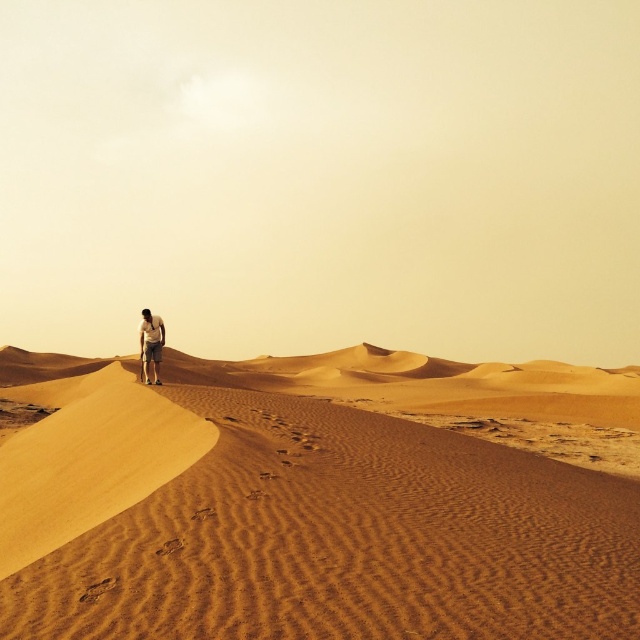
You are a hiker trying to navigate the desert. You see the sandy textured dunes at center and the light brown sand at center. Which one is positioned lower in the image?

The sandy textured dunes at center is located below light brown sand at center, so it is positioned lower in the image.

You are planning to build a sandcastle on the light brown sand at center. Considering the sandy textured dunes at center are nearby, will they block the sunlight reaching your sandcastle during the day?

The sandy textured dunes at center might be wider than light brown sand at center, so they could potentially block sunlight from reaching the sandcastle depending on their position and the sun angle.